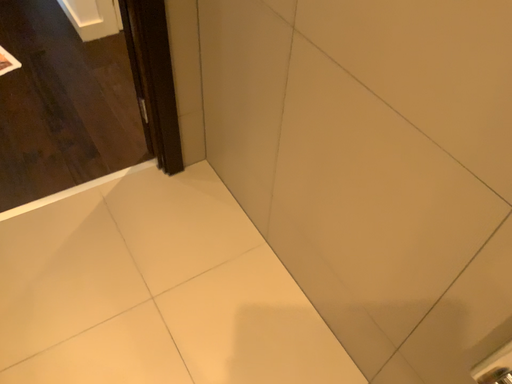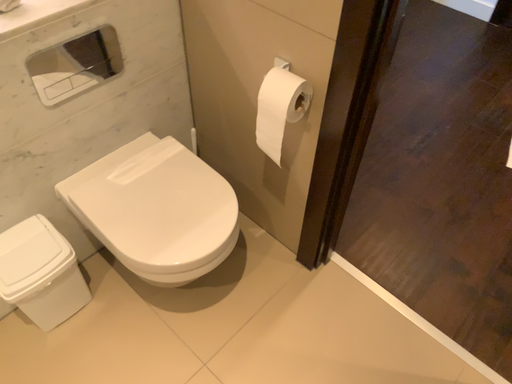
Question: Which way did the camera rotate in the video?

Choices:
 (A) rotated left
 (B) rotated right

Answer: (A)